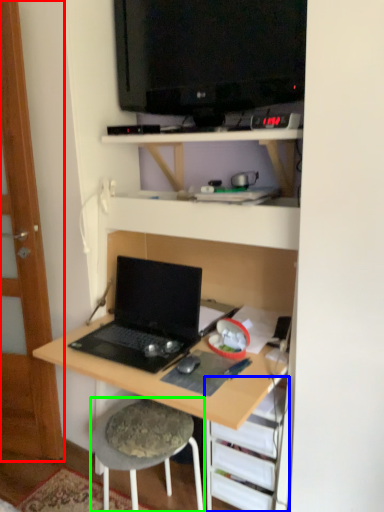
Question: Based on their relative distances, which object is farther from glass door (highlighted by a red box)? Choose from shelf (highlighted by a blue box) and stool (highlighted by a green box).

Choices:
 (A) shelf
 (B) stool

Answer: (A)